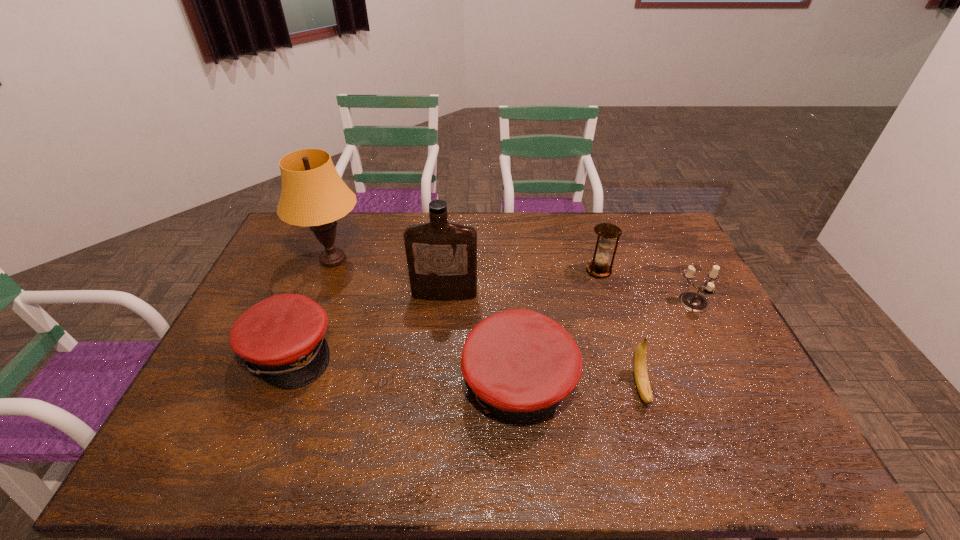
All caps are currently evenly spaced. To continue this pattern, where would you add another cap on the right? Please point out a vacant spot. Please provide its 2D coordinates. Your answer should be formatted as a tuple, i.e. [(x, y)], where the tuple contains the x and y coordinates of a point satisfying the conditions above.

[(781, 422)]